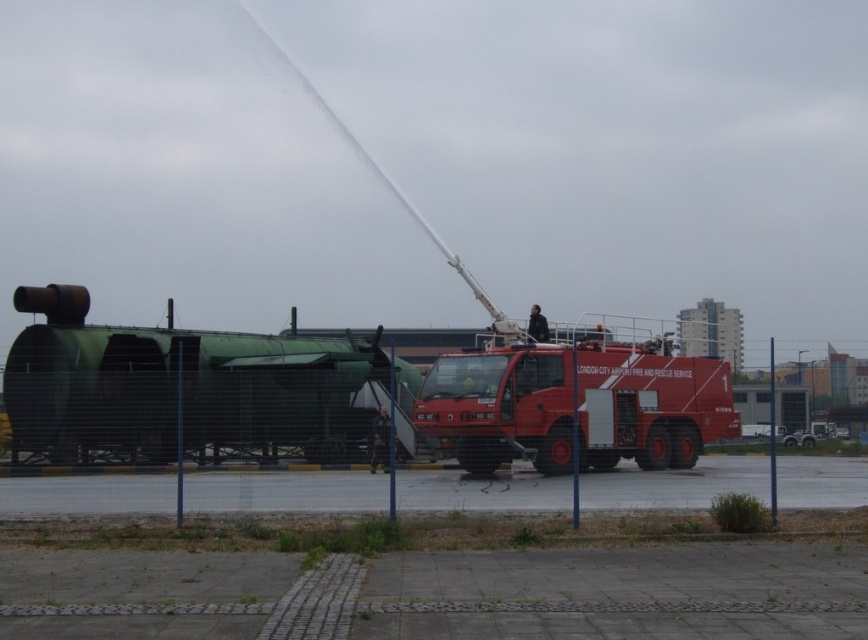
Question: Does green matte tank at left have a smaller size compared to matte red fire truck at center?

Choices:
 (A) no
 (B) yes

Answer: (A)

Question: From the image, what is the correct spatial relationship of green matte tank at left in relation to matte red fire truck at center?

Choices:
 (A) above
 (B) below

Answer: (A)

Question: Which point is farther to the camera?

Choices:
 (A) green matte tank at left
 (B) matte red fire truck at center

Answer: (B)

Question: Does green matte tank at left lie behind matte red fire truck at center?

Choices:
 (A) no
 (B) yes

Answer: (A)